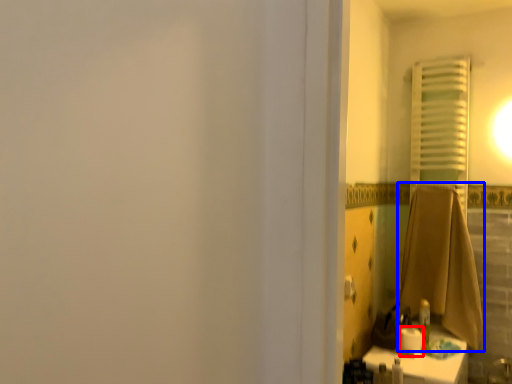
Question: Which point is further to the camera, toilet paper (highlighted by a red box) or bath towel (highlighted by a blue box)?

Choices:
 (A) toilet paper
 (B) bath towel

Answer: (B)